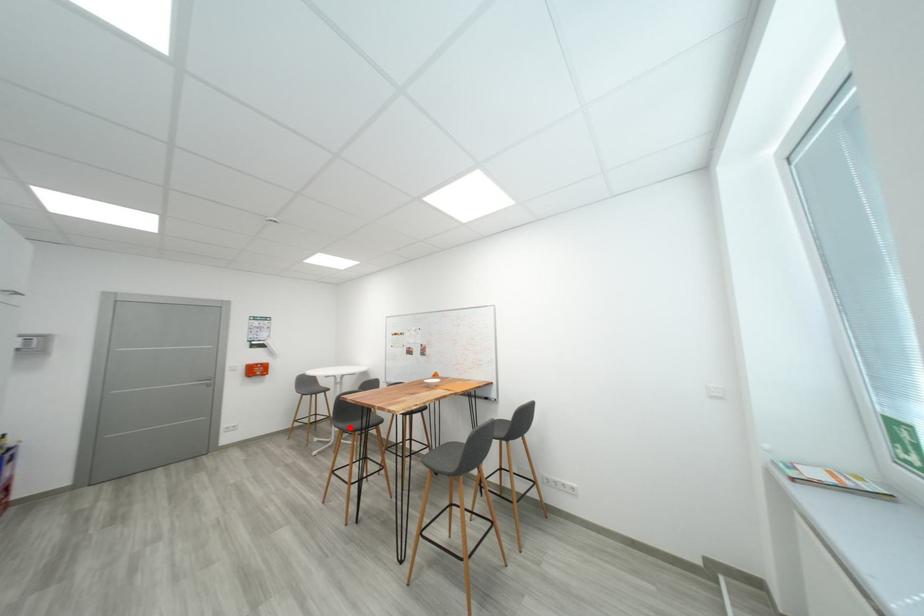
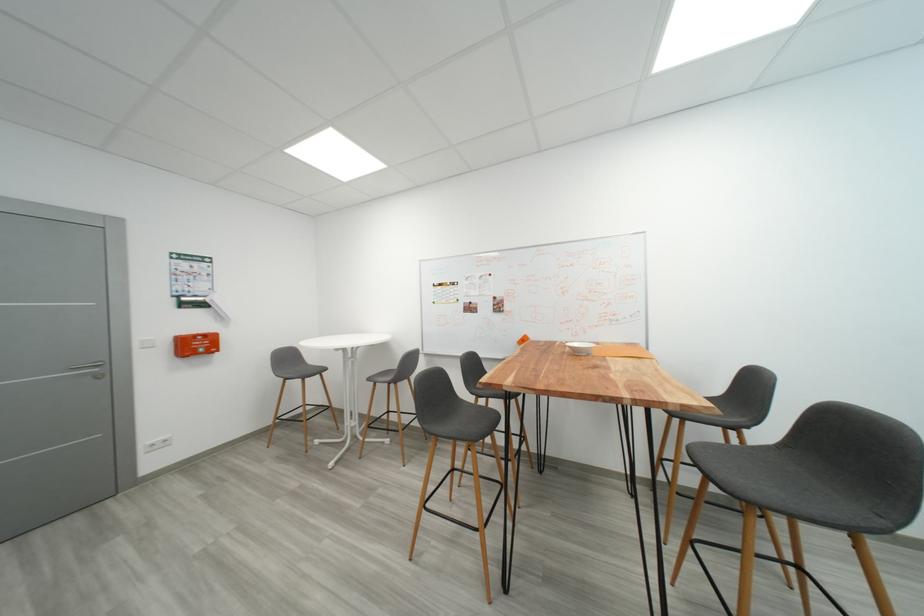
Find the pixel in the second image that matches the highlighted location in the first image.

(446, 431)